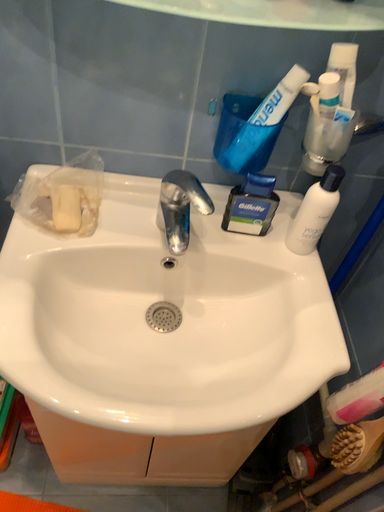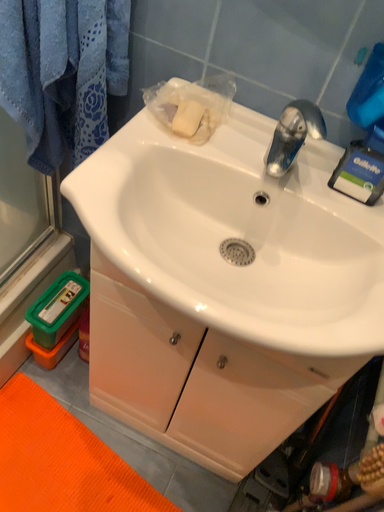
Question: Which way did the camera rotate in the video?

Choices:
 (A) rotated upward
 (B) rotated downward

Answer: (A)